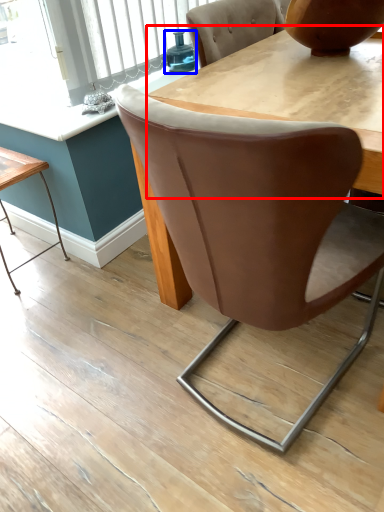
Question: Which object appears farthest to the camera in this image, round table (highlighted by a red box) or teal (highlighted by a blue box)?

Choices:
 (A) round table
 (B) teal

Answer: (B)